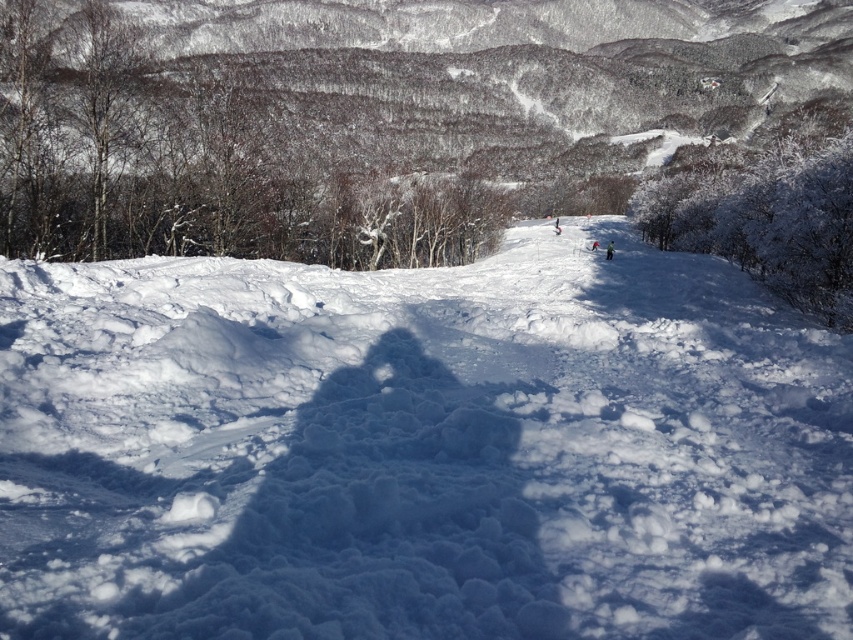
Is white fluffy snow at center smaller than white matte ski at center?

No, white fluffy snow at center is not smaller than white matte ski at center.

Can you confirm if white fluffy snow at center is taller than white matte ski at center?

Yes.

The height and width of the screenshot is (640, 853). What do you see at coordinates (421, 449) in the screenshot?
I see `white fluffy snow at center` at bounding box center [421, 449].

At what (x,y) coordinates should I click in order to perform the action: click on white fluffy snow at center. Please return your answer as a coordinate pair (x, y). Looking at the image, I should click on (421, 449).